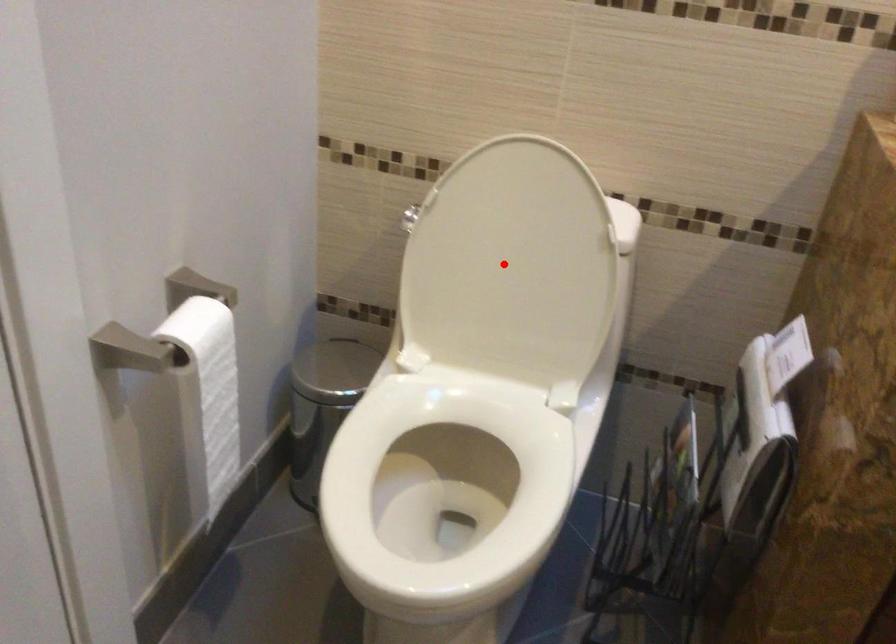
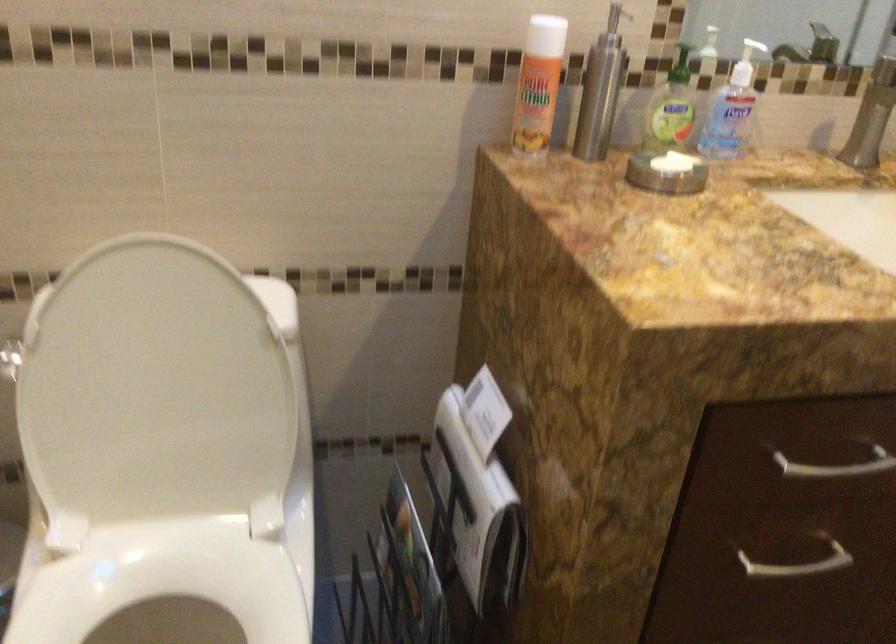
Question: I am providing you with two images of the same scene from different viewpoints. Given a red point in image1, look at the same physical point in image2. Is it:

Choices:
 (A) Closer to the viewpoint
 (B) Farther from the viewpoint

Answer: (A)